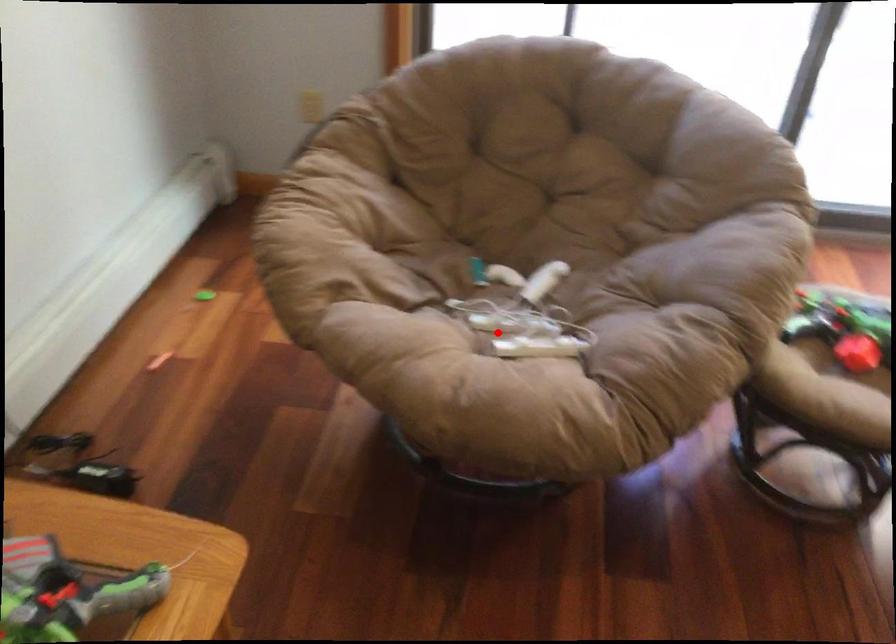
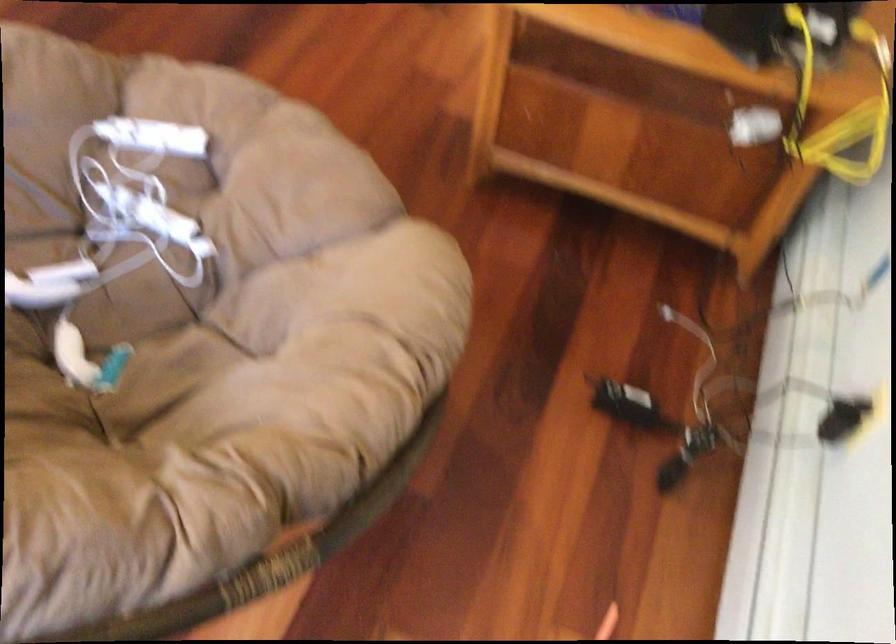
Question: I am providing you with two images of the same scene from different viewpoints. A red point is shown in image1. For the corresponding object point in image2, is it positioned nearer or farther from the camera?

Choices:
 (A) Nearer
 (B) Farther

Answer: (A)